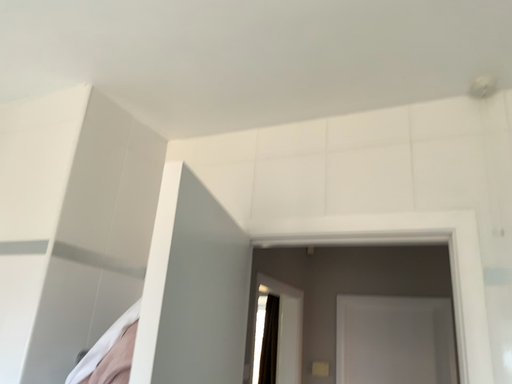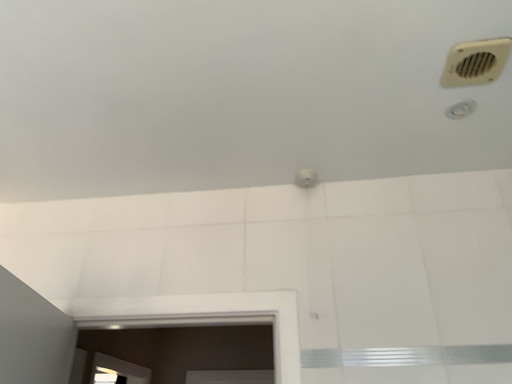
Question: Which way did the camera rotate in the video?

Choices:
 (A) rotated right
 (B) rotated left

Answer: (A)